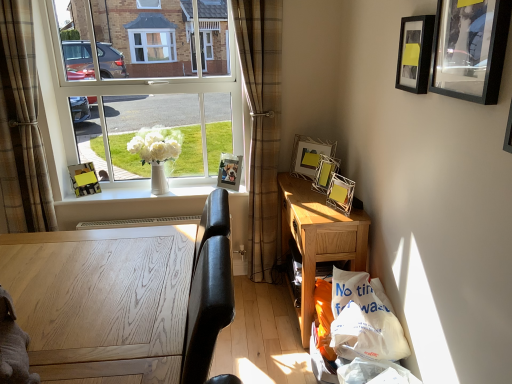
Question: Is black matte picture frame at upper right, the 5th picture frame positioned from the left, wider than gray plush toy at lower left?

Choices:
 (A) yes
 (B) no

Answer: (B)

Question: Is black matte picture frame at upper right, placed as the 5th picture frame when sorted from back to front, oriented towards gray plush toy at lower left?

Choices:
 (A) yes
 (B) no

Answer: (B)

Question: From the image's perspective, is black matte picture frame at upper right, placed as the 5th picture frame when sorted from back to front, located beneath gray plush toy at lower left?

Choices:
 (A) no
 (B) yes

Answer: (A)

Question: Is black matte picture frame at upper right, which is counted as the 2th picture frame, starting from the front, oriented away from gray plush toy at lower left?

Choices:
 (A) no
 (B) yes

Answer: (A)

Question: Can you confirm if black matte picture frame at upper right, the 2th picture frame when ordered from right to left, is smaller than gray plush toy at lower left?

Choices:
 (A) yes
 (B) no

Answer: (A)

Question: Considering the relative positions of black matte picture frame at upper right, the 2th picture frame when ordered from right to left, and gray plush toy at lower left in the image provided, is black matte picture frame at upper right, the 2th picture frame when ordered from right to left, in front of gray plush toy at lower left?

Choices:
 (A) yes
 (B) no

Answer: (B)

Question: Can you confirm if metallic silver photo frame at upper center, the first picture frame when ordered from back to front, is bigger than plaid fabric curtain at left, which ranks as the second curtain in right-to-left order?

Choices:
 (A) yes
 (B) no

Answer: (B)

Question: Considering the relative sizes of metallic silver photo frame at upper center, the first picture frame when ordered from back to front, and plaid fabric curtain at left, which ranks as the second curtain in right-to-left order, in the image provided, is metallic silver photo frame at upper center, the first picture frame when ordered from back to front, wider than plaid fabric curtain at left, which ranks as the second curtain in right-to-left order,?

Choices:
 (A) yes
 (B) no

Answer: (B)

Question: Is metallic silver photo frame at upper center, which is the second picture frame from left to right, further to the viewer compared to plaid fabric curtain at left, the first curtain in the left-to-right sequence?

Choices:
 (A) yes
 (B) no

Answer: (A)

Question: Can you confirm if metallic silver photo frame at upper center, which is the second picture frame from left to right, is smaller than plaid fabric curtain at left, the first curtain in the left-to-right sequence?

Choices:
 (A) no
 (B) yes

Answer: (B)

Question: Is metallic silver photo frame at upper center, the first picture frame when ordered from back to front, oriented towards plaid fabric curtain at left, which ranks as the second curtain in right-to-left order?

Choices:
 (A) no
 (B) yes

Answer: (A)

Question: Considering the relative positions of metallic silver photo frame at upper center, acting as the 5th picture frame starting from the right, and plaid fabric curtain at left, the first curtain in the left-to-right sequence, in the image provided, is metallic silver photo frame at upper center, acting as the 5th picture frame starting from the right, to the left of plaid fabric curtain at left, the first curtain in the left-to-right sequence, from the viewer's perspective?

Choices:
 (A) no
 (B) yes

Answer: (A)

Question: Is black matte picture frame at upper right, placed as the 5th picture frame when sorted from back to front, oriented away from white oak desk at lower left, the first desk viewed from the front?

Choices:
 (A) no
 (B) yes

Answer: (A)